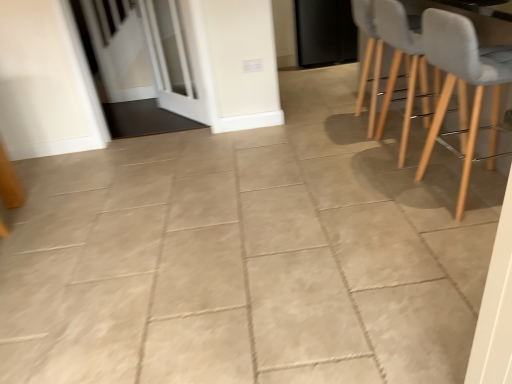
Question: Is black matte door at upper center located within white glass screen door at upper left, which appears as the 2th screen door when viewed from the back?

Choices:
 (A) yes
 (B) no

Answer: (B)

Question: Considering the relative sizes of white glass screen door at upper left, which appears as the 2th screen door when viewed from the back, and black matte door at upper center in the image provided, is white glass screen door at upper left, which appears as the 2th screen door when viewed from the back, wider than black matte door at upper center?

Choices:
 (A) no
 (B) yes

Answer: (A)

Question: Is the depth of white glass screen door at upper left, the 1th screen door in the front-to-back sequence, less than that of black matte door at upper center?

Choices:
 (A) no
 (B) yes

Answer: (B)

Question: Can you confirm if white glass screen door at upper left, the 1th screen door in the front-to-back sequence, is shorter than black matte door at upper center?

Choices:
 (A) yes
 (B) no

Answer: (B)

Question: Considering the relative sizes of white glass screen door at upper left, the 1th screen door in the front-to-back sequence, and black matte door at upper center in the image provided, is white glass screen door at upper left, the 1th screen door in the front-to-back sequence, bigger than black matte door at upper center?

Choices:
 (A) yes
 (B) no

Answer: (B)

Question: Considering the positions of white glossy screen door at upper left, the 2th screen door viewed from the front, and light gray fabric chair at right, marked as the second chair in a front-to-back arrangement, in the image, is white glossy screen door at upper left, the 2th screen door viewed from the front, wider or thinner than light gray fabric chair at right, marked as the second chair in a front-to-back arrangement,?

Choices:
 (A) wide
 (B) thin

Answer: (B)

Question: Is point (158, 36) positioned closer to the camera than point (360, 3)?

Choices:
 (A) farther
 (B) closer

Answer: (A)

Question: Which is correct: white glossy screen door at upper left, the 2th screen door viewed from the front, is inside light gray fabric chair at right, marked as the second chair in a front-to-back arrangement, or outside of it?

Choices:
 (A) outside
 (B) inside

Answer: (A)

Question: From the image's perspective, is white glossy screen door at upper left, the 2th screen door viewed from the front, above or below light gray fabric chair at right, marked as the second chair in a front-to-back arrangement?

Choices:
 (A) above
 (B) below

Answer: (A)

Question: In the image, is white glass screen door at upper left, which appears as the 2th screen door when viewed from the back, positioned in front of or behind white glossy screen door at upper left, the first screen door positioned from the back?

Choices:
 (A) behind
 (B) front

Answer: (B)

Question: Is white glass screen door at upper left, the 1th screen door in the front-to-back sequence, situated inside white glossy screen door at upper left, the 2th screen door viewed from the front, or outside?

Choices:
 (A) inside
 (B) outside

Answer: (B)

Question: Considering the positions of white glass screen door at upper left, which appears as the 2th screen door when viewed from the back, and white glossy screen door at upper left, the first screen door positioned from the back, in the image, is white glass screen door at upper left, which appears as the 2th screen door when viewed from the back, taller or shorter than white glossy screen door at upper left, the first screen door positioned from the back,?

Choices:
 (A) short
 (B) tall

Answer: (A)

Question: Is white glass screen door at upper left, the 1th screen door in the front-to-back sequence, bigger or smaller than white glossy screen door at upper left, the first screen door positioned from the back?

Choices:
 (A) big
 (B) small

Answer: (B)

Question: In the image, is light gray fabric chair at right, which appears as the 2th chair when viewed from the back, positioned in front of or behind light gray fabric chair at right, which is the 1th chair in back-to-front order?

Choices:
 (A) behind
 (B) front

Answer: (B)

Question: In terms of height, does light gray fabric chair at right, which appears as the 2th chair when viewed from the back, look taller or shorter compared to light gray fabric chair at right, which is the 1th chair in back-to-front order?

Choices:
 (A) short
 (B) tall

Answer: (B)